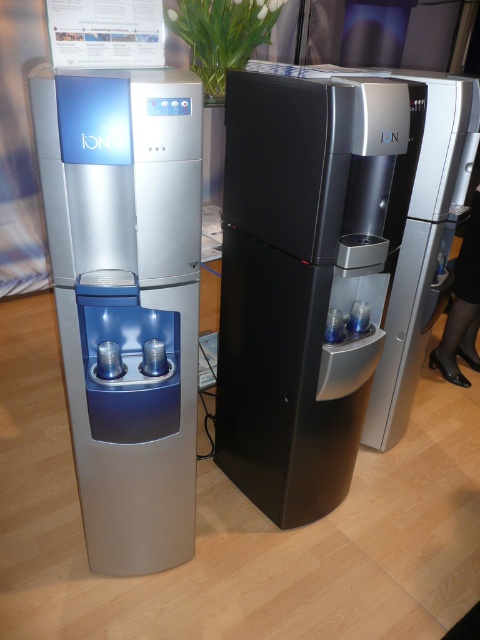
Question: Does black matte water cooler at center lie in front of satin silver water dispenser at left?

Choices:
 (A) yes
 (B) no

Answer: (B)

Question: Does black matte water cooler at center appear under satin silver water dispenser at left?

Choices:
 (A) yes
 (B) no

Answer: (B)

Question: Is black matte water cooler at center to the right of satin silver water dispenser at left from the viewer's perspective?

Choices:
 (A) yes
 (B) no

Answer: (A)

Question: Among these objects, which one is nearest to the camera?

Choices:
 (A) black matte water cooler at center
 (B) satin silver water dispenser at left

Answer: (B)